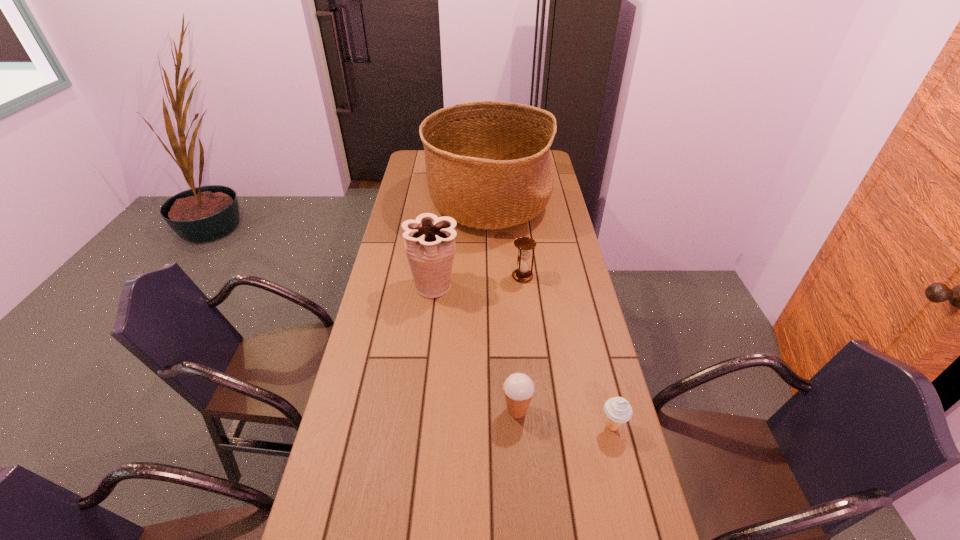
You are a GUI agent. You are given a task and a screenshot of the screen. Output one action in this format:
    pyautogui.click(x=<x>, y=<y>)
    Task: Click on the vacant region that satisfies the following two spatial constraints: 1. on the front side of the urn; 2. on the left side of the left icecream
    
    Given the screenshot: What is the action you would take?
    pyautogui.click(x=420, y=410)

This screenshot has width=960, height=540. What are the coordinates of `vacant space that satisfies the following two spatial constraints: 1. on the front side of the right icecream; 2. on the left side of the basket` in the screenshot? It's located at (493, 427).